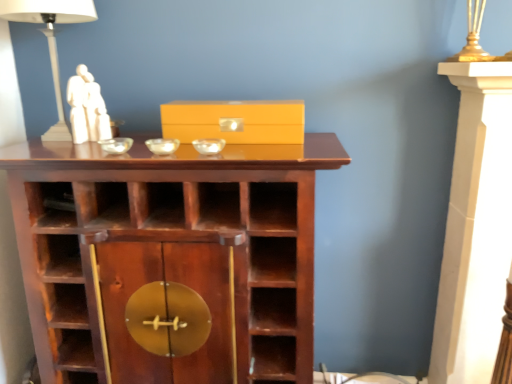
Locate an element on the screen. The height and width of the screenshot is (384, 512). vacant area that is situated to the right of white ceramic table lamp at upper left is located at coordinates (132, 137).